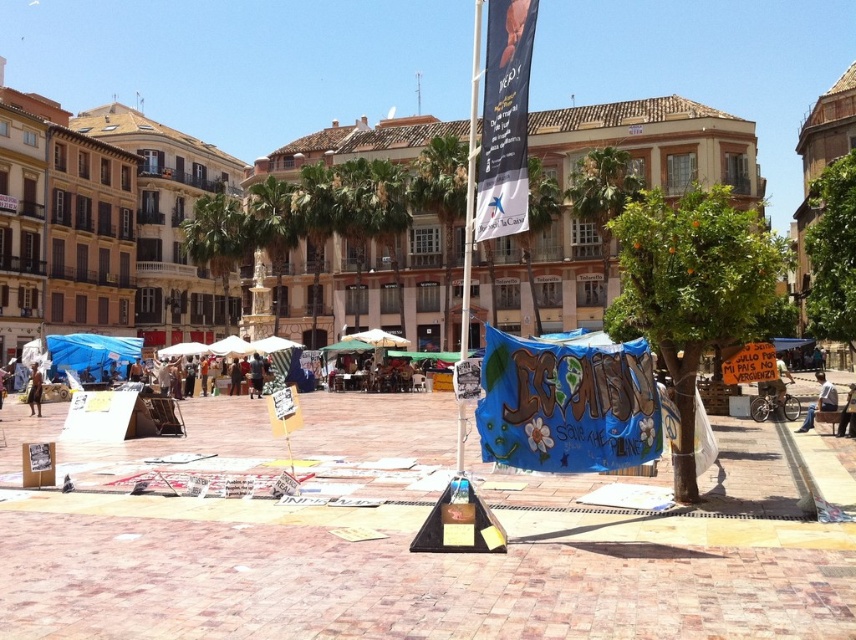
You are a city planner wanting to install a new bench in the public square. The bench will be placed exactly halfway between the blue fabric banner at center and the white fabric banner at center. How far in meters will the bench be from each banner?

The bench will be placed exactly halfway between the blue fabric banner at center and the white fabric banner at center. Since the distance between them is 9.21 meters, the halfway point would be at 4.605 meters from each banner.

You are standing in the public square and want to take a photo of the blue fabric banner at center. According to the scene description, where should you position yourself to capture the banner in the frame?

The blue fabric banner at center is located at the coordinates 0.633 on the x axis and 0.664 on the y axis, so you should position yourself facing that point to capture it in the frame.